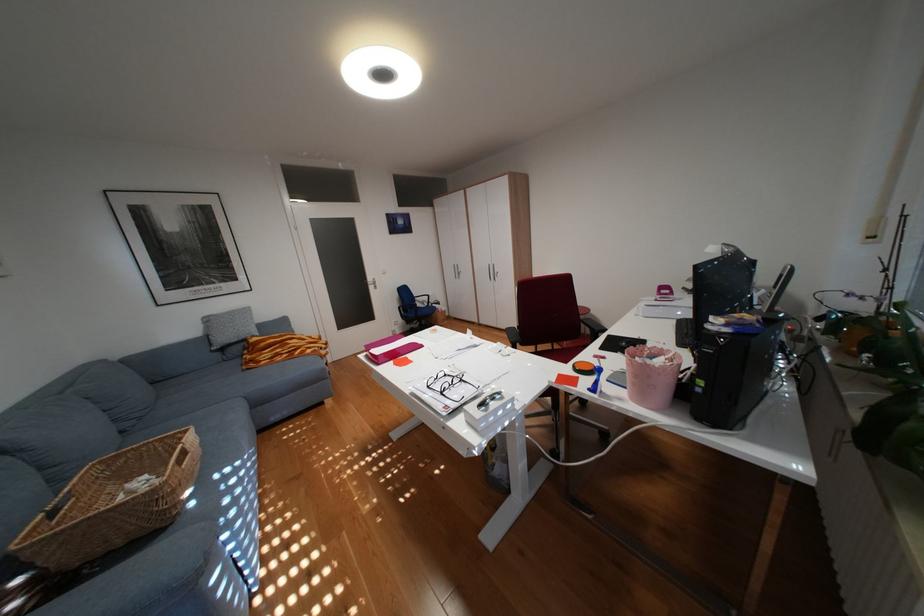
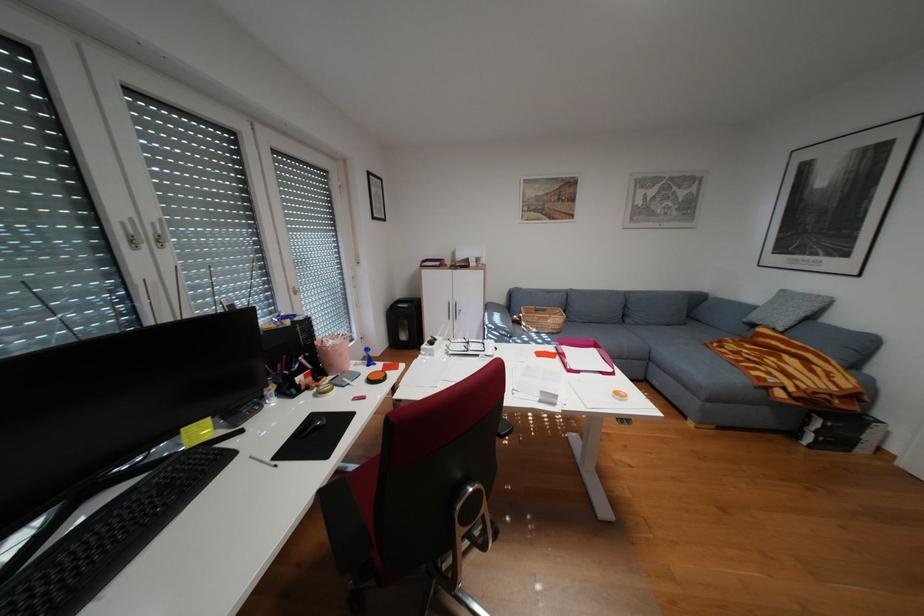
Question: I am providing you with two images of the same scene from different viewpoints. Please identify which objects are invisible in image2.

Choices:
 (A) blue desk object
 (B) silver cabinet handle
 (C) pink paper tray
 (D) none of these

Answer: (D)